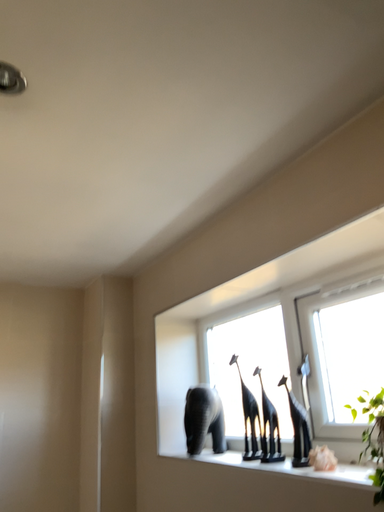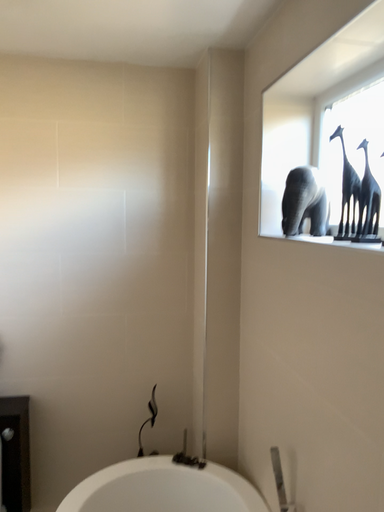
Question: Which way did the camera rotate in the video?

Choices:
 (A) rotated upward
 (B) rotated downward

Answer: (B)